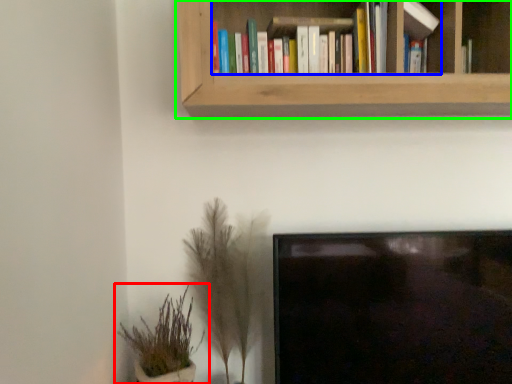
Question: Estimate the real-world distances between objects in this image. Which object is closer to houseplant (highlighted by a red box), book (highlighted by a blue box) or bookcase (highlighted by a green box)?

Choices:
 (A) book
 (B) bookcase

Answer: (B)